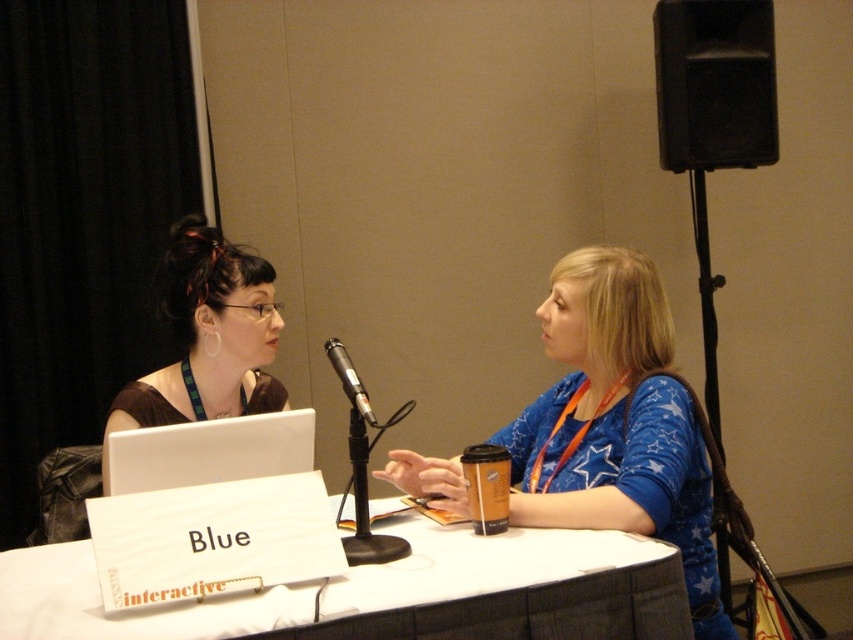
Does white paperboard at center appear on the right side of black metallic microphone at center?

Incorrect, white paperboard at center is not on the right side of black metallic microphone at center.

Between white paperboard at center and black metallic microphone at center, which one appears on the left side from the viewer's perspective?

white paperboard at center is more to the left.

Identify the location of white paperboard at center. This screenshot has height=640, width=853. (386, 593).

Where is `white paperboard at center`? This screenshot has height=640, width=853. white paperboard at center is located at coordinates (386, 593).

Is point (531, 435) farther from camera compared to point (262, 260)?

That is False.

You are a GUI agent. You are given a task and a screenshot of the screen. Output one action in this format:
    pyautogui.click(x=<x>, y=<y>)
    Task: Click on the blue fabric shirt at center
    
    Given the screenshot: What is the action you would take?
    pyautogui.click(x=616, y=422)

Does white paperboard at center have a lesser height compared to blue fabric shirt at center?

Indeed, white paperboard at center has a lesser height compared to blue fabric shirt at center.

Is white paperboard at center bigger than blue fabric shirt at center?

No, white paperboard at center is not bigger than blue fabric shirt at center.

Between point (311, 595) and point (646, 452), which one is positioned behind?

The point (646, 452) is behind.

This screenshot has width=853, height=640. I want to click on white paperboard at center, so click(386, 593).